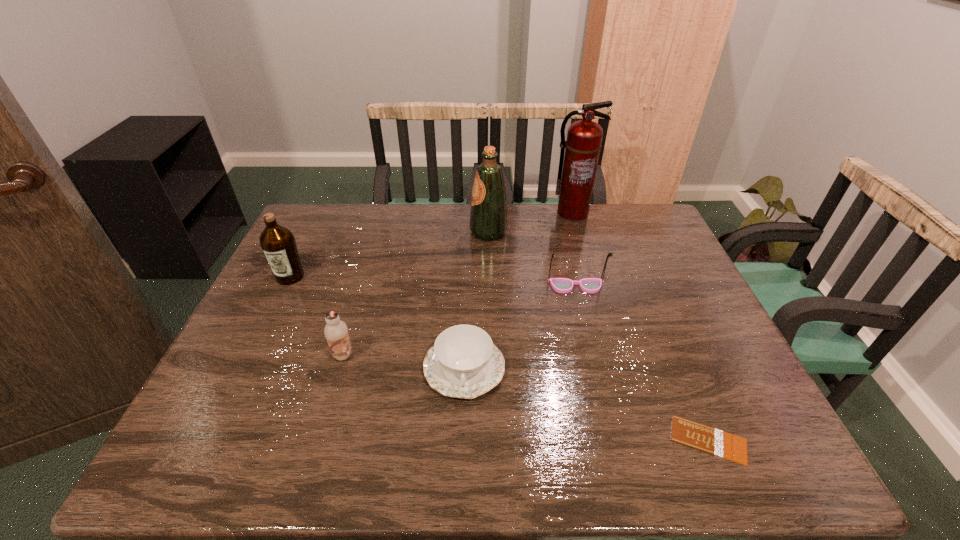
The image size is (960, 540). Find the location of `the shortest object`. the shortest object is located at coordinates (708, 439).

The height and width of the screenshot is (540, 960). I want to click on free spot located 0.270m on the side of the tallest object with the handle and hose, so click(x=589, y=273).

Identify the location of vacant space positioned on the front-facing side of the taller olive oil. The height and width of the screenshot is (540, 960). (385, 232).

This screenshot has height=540, width=960. In order to click on vacant region located 0.280m on the front-facing side of the taller olive oil in this screenshot , I will do `click(385, 232)`.

You are a GUI agent. You are given a task and a screenshot of the screen. Output one action in this format:
    pyautogui.click(x=<x>, y=<y>)
    Task: Click on the vacant region located on the front-facing side of the taller olive oil
    
    Given the screenshot: What is the action you would take?
    pyautogui.click(x=354, y=232)

Find the location of a particular element. vacant space located 0.110m on the label of the leftmost object is located at coordinates (272, 315).

Identify the location of vacant space situated 0.210m on the right of the chocolate milk. (441, 355).

Locate an element on the screen. Image resolution: width=960 pixels, height=540 pixels. blank area located on the back of the spectacles is located at coordinates (560, 220).

I want to click on free location located on the handle side of the second shortest object, so click(x=462, y=432).

Locate an element on the screen. This screenshot has height=540, width=960. free spot located 0.170m on the back of the nearest object is located at coordinates pyautogui.click(x=672, y=353).